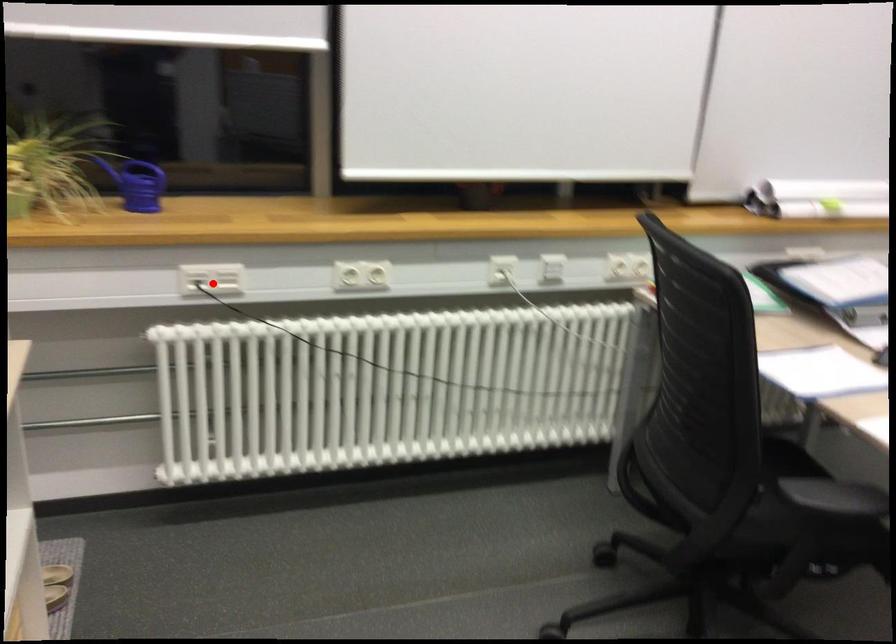
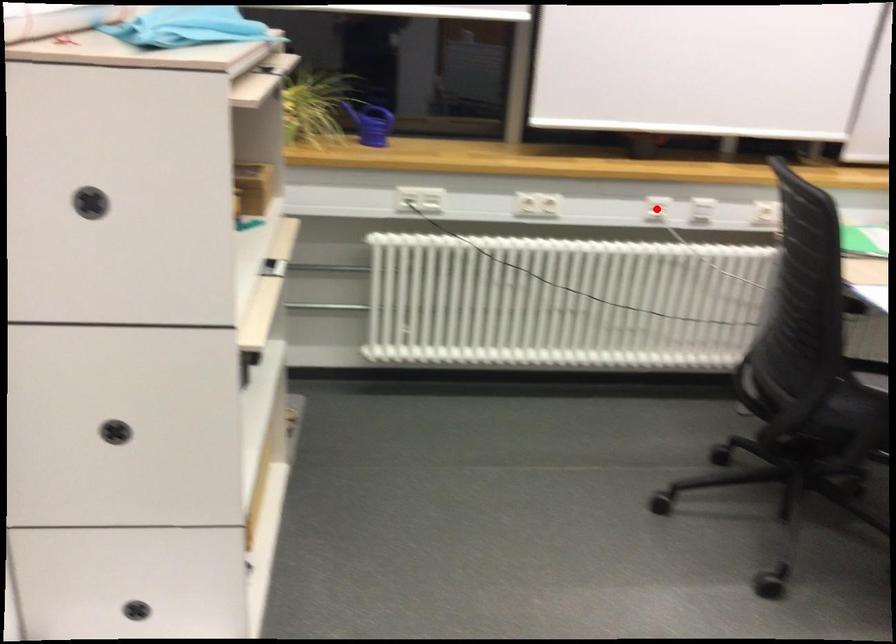
I am providing you with two images of the same scene from different viewpoints. A red point is marked on the first image and another point is marked on the second image. Does the point marked in image1 correspond to the same location as the one in image2?

No